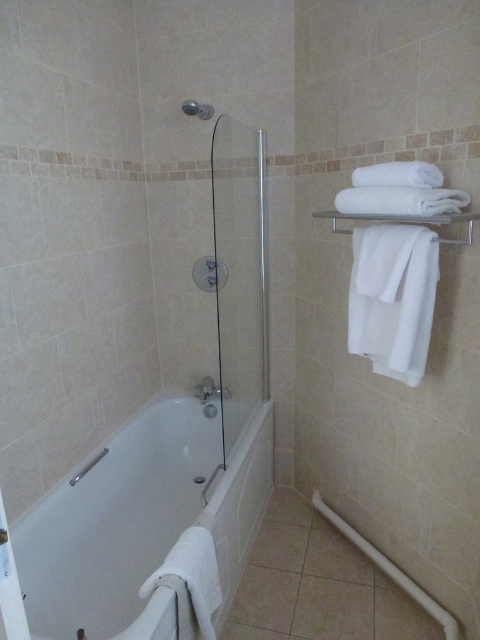
Question: Which point is closer to the camera?

Choices:
 (A) [84, 468]
 (B) [135, 476]

Answer: (A)

Question: Does white glossy bathtub at center have a greater width compared to clear glass shower door at center?

Choices:
 (A) yes
 (B) no

Answer: (A)

Question: Among these points, which one is farthest from the camera?

Choices:
 (A) (204, 104)
 (B) (217, 493)
 (C) (249, 288)

Answer: (C)

Question: Which object is positioned farthest from the brushed metal shower at lower left?

Choices:
 (A) white glossy bathtub at center
 (B) clear glass shower door at center
 (C) matte silver shower at upper center

Answer: (C)

Question: Is matte silver shower at upper center positioned before brushed metal shower at lower left?

Choices:
 (A) no
 (B) yes

Answer: (A)

Question: Is white glossy bathtub at center thinner than clear glass shower door at center?

Choices:
 (A) no
 (B) yes

Answer: (A)